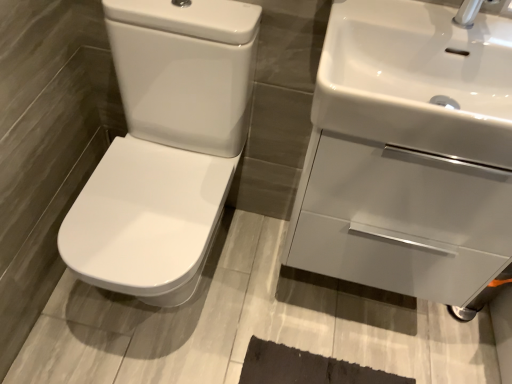
Question: Is white glossy toilet at left at the back of white glossy sink at upper right, the 2th sink viewed from the front?

Choices:
 (A) no
 (B) yes

Answer: (A)

Question: Is white glossy sink at upper right, the 2th sink viewed from the front, positioned far away from white glossy toilet at left?

Choices:
 (A) yes
 (B) no

Answer: (B)

Question: Is white glossy sink at upper right, the 2th sink viewed from the front, shorter than white glossy toilet at left?

Choices:
 (A) yes
 (B) no

Answer: (A)

Question: Is white glossy sink at upper right, the 2th sink viewed from the front, next to white glossy toilet at left?

Choices:
 (A) yes
 (B) no

Answer: (B)

Question: From the image's perspective, is white glossy sink at upper right, which is the first sink in back-to-front order, over white glossy toilet at left?

Choices:
 (A) no
 (B) yes

Answer: (B)

Question: Is white glossy sink at upper right, which is the first sink in back-to-front order, completely or partially outside of white glossy toilet at left?

Choices:
 (A) no
 (B) yes

Answer: (B)

Question: Does white glossy toilet at left appear on the right side of white glossy sink at upper right, which appears as the second sink when viewed from the back?

Choices:
 (A) no
 (B) yes

Answer: (A)

Question: Is white glossy sink at upper right, which is counted as the 1th sink, starting from the front, inside white glossy toilet at left?

Choices:
 (A) no
 (B) yes

Answer: (A)

Question: From a real-world perspective, does white glossy toilet at left sit lower than white glossy sink at upper right, which is counted as the 1th sink, starting from the front?

Choices:
 (A) no
 (B) yes

Answer: (B)

Question: Could you tell me if white glossy toilet at left is turned towards white glossy sink at upper right, which is counted as the 1th sink, starting from the front?

Choices:
 (A) no
 (B) yes

Answer: (A)

Question: From a real-world perspective, is white glossy toilet at left on white glossy sink at upper right, which appears as the second sink when viewed from the back?

Choices:
 (A) no
 (B) yes

Answer: (A)

Question: Does white glossy toilet at left have a smaller size compared to white glossy sink at upper right, which appears as the second sink when viewed from the back?

Choices:
 (A) no
 (B) yes

Answer: (A)

Question: Is white glossy toilet at left surrounded by white glossy sink at upper right, which appears as the second sink when viewed from the back?

Choices:
 (A) no
 (B) yes

Answer: (A)